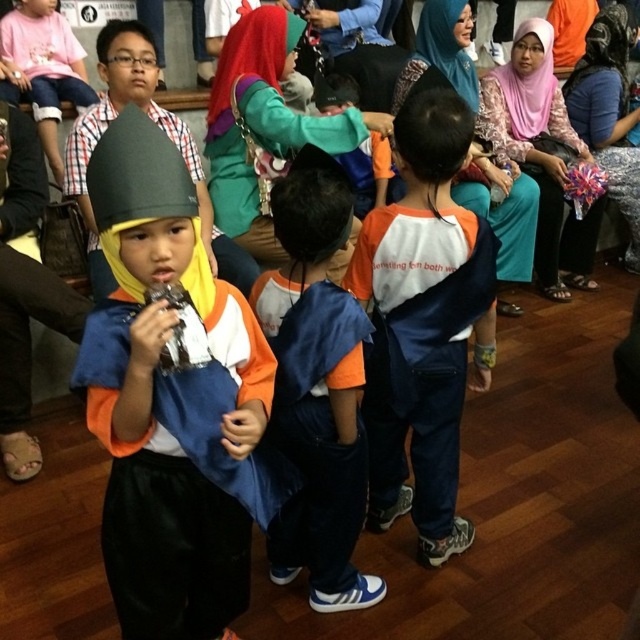
Who is shorter, matte black helmet at center or orange fabric shirt at center?

With less height is matte black helmet at center.

Who is positioned more to the right, matte black helmet at center or orange fabric shirt at center?

From the viewer's perspective, orange fabric shirt at center appears more on the right side.

Measure the distance between point (170, 529) and camera.

A distance of 1.30 meters exists between point (170, 529) and camera.

You are a GUI agent. You are given a task and a screenshot of the screen. Output one action in this format:
    pyautogui.click(x=<x>, y=<y>)
    Task: Click on the matte black helmet at center
    
    Given the screenshot: What is the action you would take?
    pyautogui.click(x=157, y=396)

Which is in front, point (113, 173) or point (328, 321)?

Point (113, 173) is in front.

Is matte black helmet at center shorter than orange cotton shirt at center?

Correct, matte black helmet at center is not as tall as orange cotton shirt at center.

The height and width of the screenshot is (640, 640). I want to click on matte black helmet at center, so click(x=157, y=396).

Locate an element on the screen. The height and width of the screenshot is (640, 640). matte black helmet at center is located at coordinates (157, 396).

From the picture: Can you confirm if matte black helmet at center is bigger than pink satin hijab at upper right?

Incorrect, matte black helmet at center is not larger than pink satin hijab at upper right.

This screenshot has height=640, width=640. Describe the element at coordinates (157, 396) in the screenshot. I see `matte black helmet at center` at that location.

Identify the location of matte black helmet at center. (157, 396).